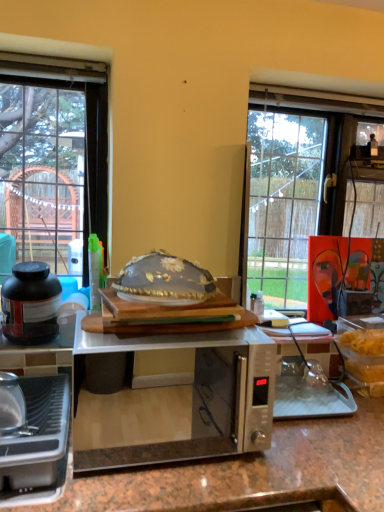
Question: Is translucent glass bowl at center not within metallic silver toaster at lower left, acting as the first kitchen appliance starting from the bottom?

Choices:
 (A) no
 (B) yes

Answer: (B)

Question: Can you confirm if translucent glass bowl at center is bigger than metallic silver toaster at lower left, the first kitchen appliance when ordered from front to back?

Choices:
 (A) no
 (B) yes

Answer: (B)

Question: Does translucent glass bowl at center have a lesser height compared to metallic silver toaster at lower left, acting as the first kitchen appliance starting from the bottom?

Choices:
 (A) yes
 (B) no

Answer: (A)

Question: Would you say translucent glass bowl at center contains metallic silver toaster at lower left, the second kitchen appliance in the back-to-front sequence?

Choices:
 (A) no
 (B) yes

Answer: (A)

Question: Is translucent glass bowl at center oriented away from metallic silver toaster at lower left, the first kitchen appliance when ordered from front to back?

Choices:
 (A) no
 (B) yes

Answer: (A)

Question: Considering the positions of metallic silver toaster at lower left, acting as the first kitchen appliance starting from the bottom, and translucent glass bowl at center in the image, is metallic silver toaster at lower left, acting as the first kitchen appliance starting from the bottom, wider or thinner than translucent glass bowl at center?

Choices:
 (A) wide
 (B) thin

Answer: (A)

Question: Would you say metallic silver toaster at lower left, the second kitchen appliance in the back-to-front sequence, is inside or outside translucent glass bowl at center?

Choices:
 (A) inside
 (B) outside

Answer: (B)

Question: Is point (1, 482) positioned closer to the camera than point (195, 293)?

Choices:
 (A) farther
 (B) closer

Answer: (B)

Question: From a real-world perspective, is metallic silver toaster at lower left, the second kitchen appliance in the back-to-front sequence, physically located above or below translucent glass bowl at center?

Choices:
 (A) below
 (B) above

Answer: (A)

Question: Does point (145, 273) appear closer or farther from the camera than point (18, 328)?

Choices:
 (A) farther
 (B) closer

Answer: (B)

Question: Considering the positions of translucent glass bowl at center and matte black jar at left, the 2th kitchen appliance viewed from the front, in the image, is translucent glass bowl at center bigger or smaller than matte black jar at left, the 2th kitchen appliance viewed from the front,?

Choices:
 (A) small
 (B) big

Answer: (B)

Question: Is translucent glass bowl at center wider or thinner than matte black jar at left, the 1th kitchen appliance from the back?

Choices:
 (A) wide
 (B) thin

Answer: (A)

Question: Which is correct: translucent glass bowl at center is inside matte black jar at left, placed as the 1th kitchen appliance when sorted from top to bottom, or outside of it?

Choices:
 (A) inside
 (B) outside

Answer: (B)

Question: Considering their positions, is matte black jar at left, the 2th kitchen appliance positioned from the bottom, located in front of or behind satin silver microwave at center?

Choices:
 (A) behind
 (B) front

Answer: (A)

Question: From the image's perspective, relative to satin silver microwave at center, is matte black jar at left, the 2th kitchen appliance viewed from the front, above or below?

Choices:
 (A) below
 (B) above

Answer: (B)